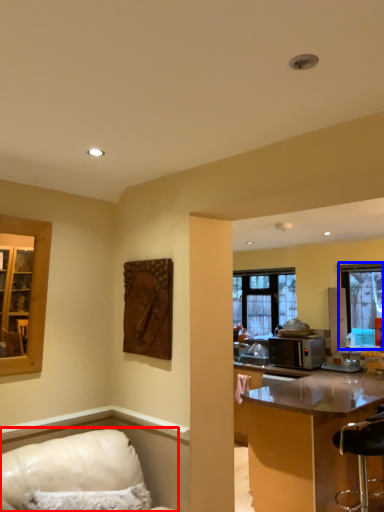
Question: Which object appears farthest to the camera in this image, furniture (highlighted by a red box) or window (highlighted by a blue box)?

Choices:
 (A) furniture
 (B) window

Answer: (B)